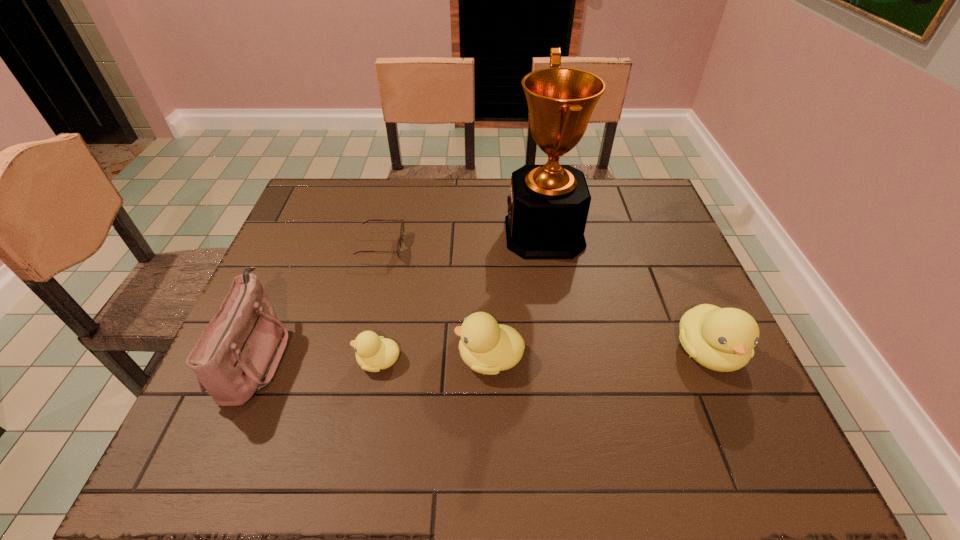
To make them evenly spaced by inserting another duckling among them, please locate a vacant spot for this new duckling. Please provide its 2D coordinates. Your answer should be formatted as a tuple, i.e. [(x, y)], where the tuple contains the x and y coordinates of a point satisfying the conditions above.

[(600, 355)]